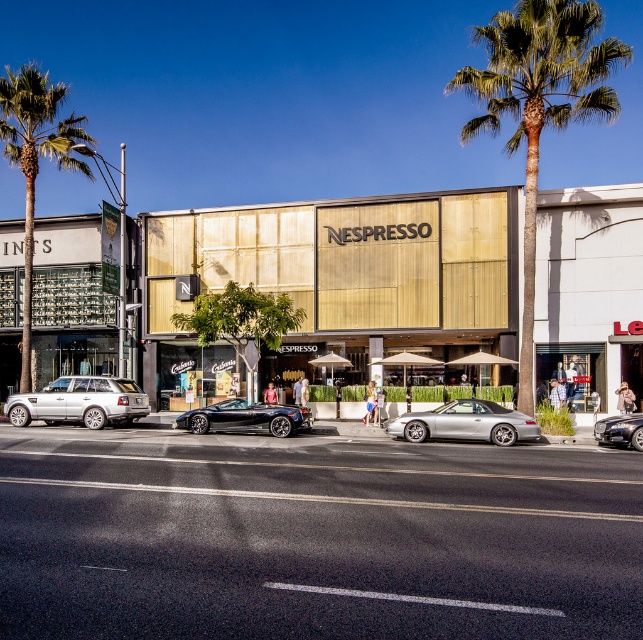
You are standing in front of the Nespresso store and want to take a photo of both the point at coordinates point [476,436] and point [264,422]. Which point should you focus on first to ensure both are in focus?

You should focus on point [476,436] first because it is closer to you than point [264,422], so adjusting focus from near to far will help both points be in focus.

You are standing at the entrance of the Nespresso store and want to park your car. The parking spot you want to use is at coordinate point 0.661, 0.725. Is the silver metallic car at center currently occupying that spot?

The silver metallic car at center is located at point (466,422), so yes, it is occupying the parking spot you want to use.

You are standing at the camera position and want to take a photo of the silver metallic car at center. Is the car within the camera frame if the camera has a 50mm lens?

The silver metallic car at center and camera are 22.68 meters apart from each other. With a 50mm lens, the camera can capture objects at that distance within its frame.